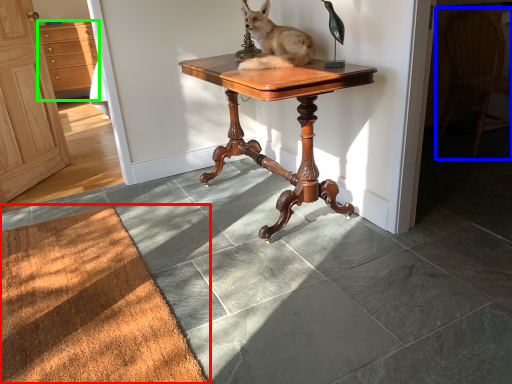
Question: Which object is the farthest from doormat (highlighted by a red box)? Choose among these: chair (highlighted by a blue box) or cabinetry (highlighted by a green box).

Choices:
 (A) chair
 (B) cabinetry

Answer: (B)